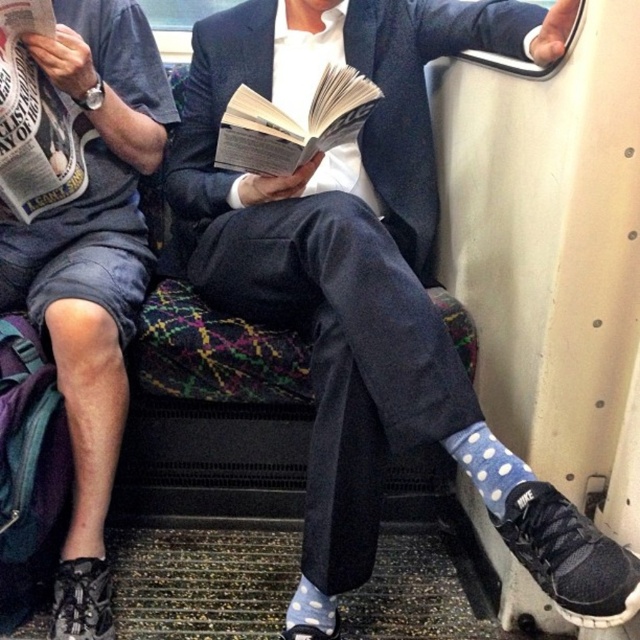
Can you confirm if blue polka dot socks at lower center is positioned above matte gray shorts at left?

Yes.

Is point (614, 580) more distant than point (154, 49)?

No, (614, 580) is in front of (154, 49).

Image resolution: width=640 pixels, height=640 pixels. Identify the location of blue polka dot socks at lower center. (369, 280).